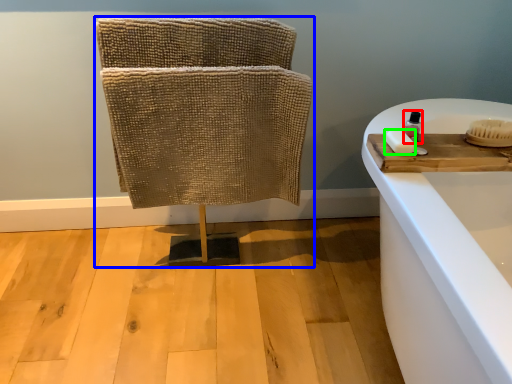
Question: Which is nearer to the toiletry (highlighted by a red box)? furniture (highlighted by a blue box) or soap (highlighted by a green box).

Choices:
 (A) furniture
 (B) soap

Answer: (B)